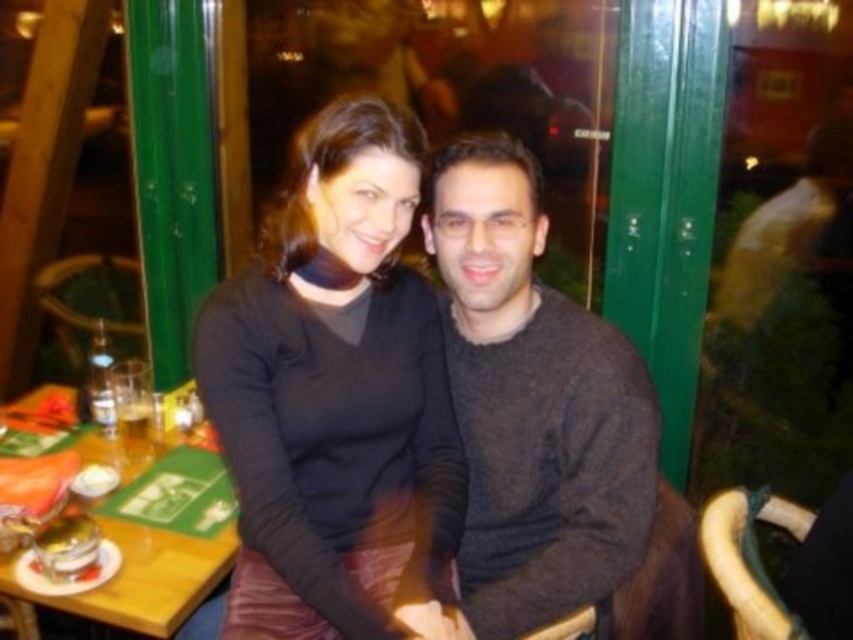
From the picture: You are a tailor measuring sweaters for a customer. You see the black matte sweater at center and the dark gray sweater at center. Which sweater is smaller in size?

The black matte sweater at center is smaller in size compared to the dark gray sweater at center.